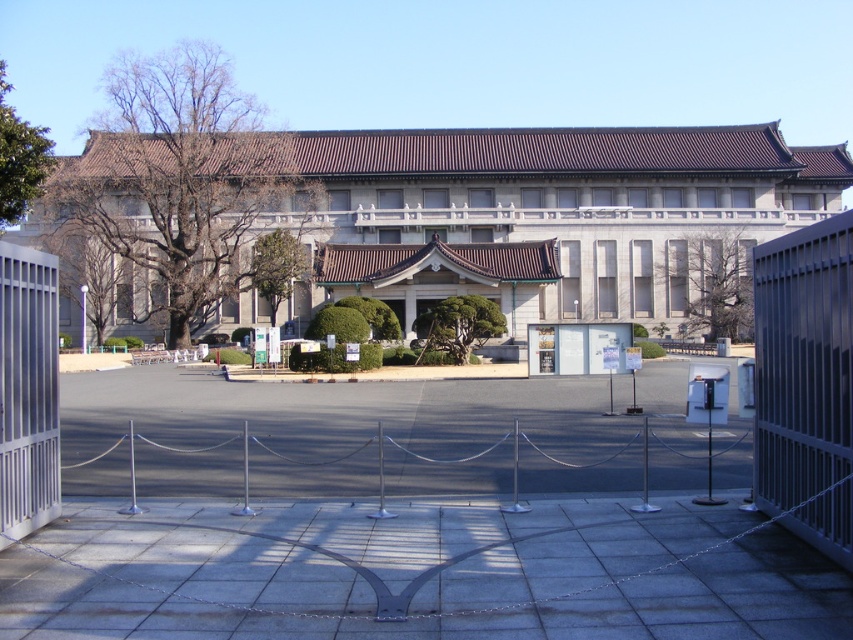
Does metallic gray gate at right appear on the left side of metallic gate at left?

Incorrect, metallic gray gate at right is not on the left side of metallic gate at left.

Image resolution: width=853 pixels, height=640 pixels. What are the coordinates of `metallic gray gate at right` in the screenshot? It's located at (802, 362).

Does point (502, 172) come behind point (28, 316)?

Yes, point (502, 172) is farther from viewer.

Between point (212, 241) and point (22, 288), which one is positioned behind?

Positioned behind is point (212, 241).

Is point (665, 131) closer to camera compared to point (9, 413)?

No.

You are a GUI agent. You are given a task and a screenshot of the screen. Output one action in this format:
    pyautogui.click(x=<x>, y=<y>)
    Task: Click on the stone gray building at center
    The height and width of the screenshot is (640, 853).
    Given the screenshot: What is the action you would take?
    pyautogui.click(x=450, y=220)

Which is more to the left, metallic gray gate at right or silver metallic fence at center?

silver metallic fence at center

Who is more distant from viewer, (831, 541) or (688, 456)?

Positioned behind is point (688, 456).

In order to click on metallic gray gate at right in this screenshot , I will do `click(802, 362)`.

At what (x,y) coordinates should I click in order to perform the action: click on metallic gray gate at right. Please return your answer as a coordinate pair (x, y). The width and height of the screenshot is (853, 640). Looking at the image, I should click on (802, 362).